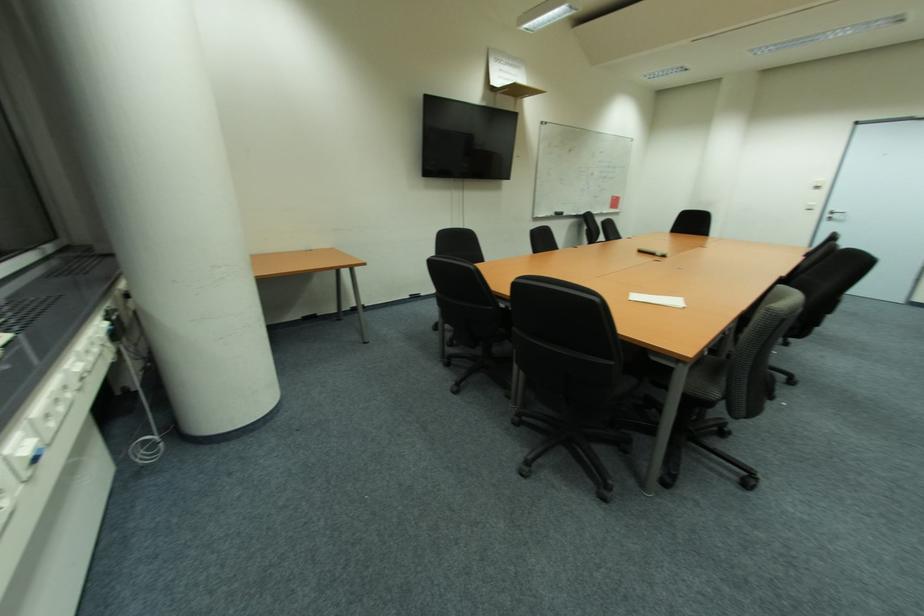
This screenshot has height=616, width=924. Identify the location of black chair sitting surface. (715, 376).